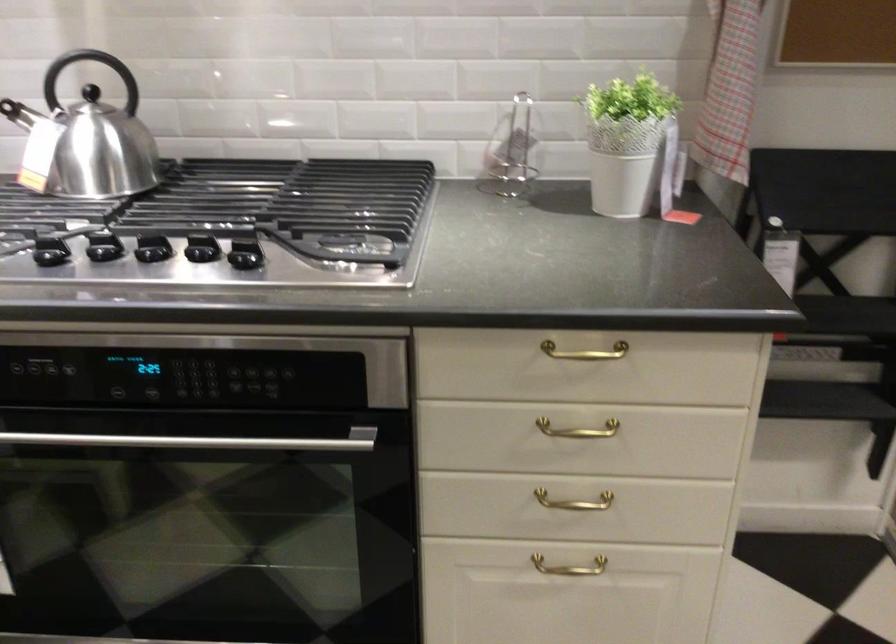
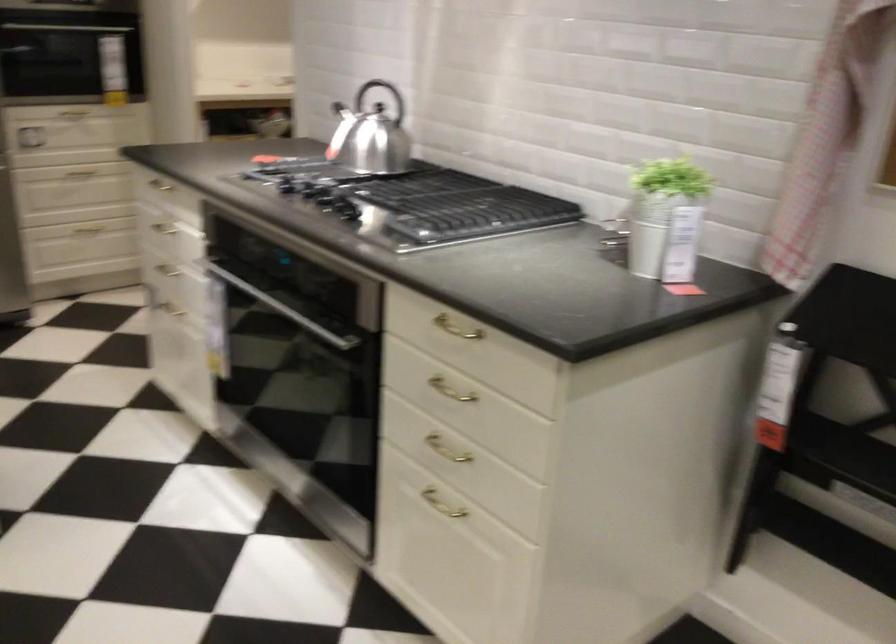
Where in the second image is the point corresponding to point (184, 442) from the first image?

(282, 308)